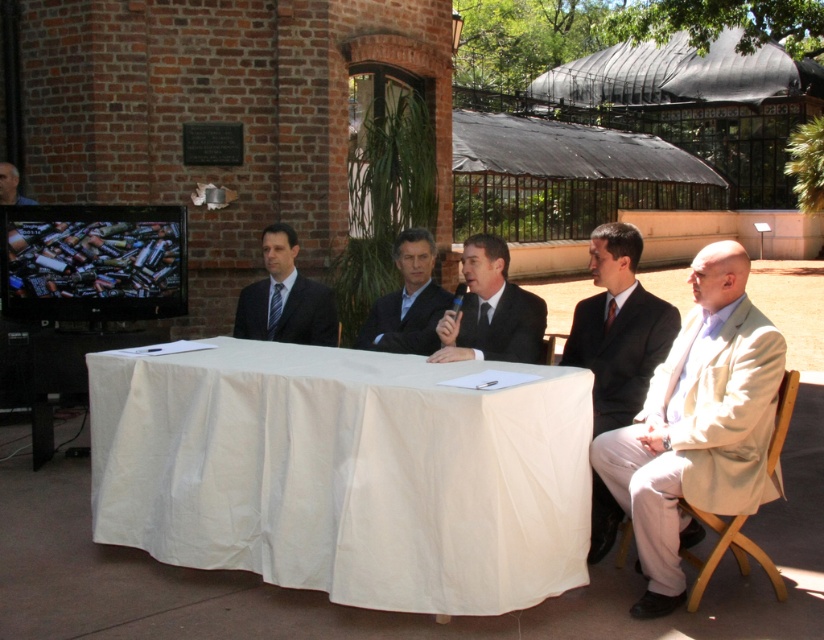
Based on the photo, you are a photographer at the event and need to adjust the camera angle to ensure both the beige fabric suit at right and the matte black suit at center are clearly visible. Considering their heights, which suit might require you to angle the camera higher to capture the person fully?

The beige fabric suit at right is much taller than the matte black suit at center, so angling the camera higher would be necessary to capture the person in the beige fabric suit at right fully.

Based on the photo, you are a photographer trying to capture a closeup of the two points in the image. Which point, point (336, 348) or point (265, 308), is closer to your camera lens?

Point (336, 348) is closer to the camera lens than point (265, 308).

You are standing in front of the table where the men are seated. There are two points marked on the table surface. The first point is at coordinates point (x=640, y=483) and the second point is at point (x=499, y=328). Which point is closer to you?

Point (x=640, y=483) is closer to the viewer than point (x=499, y=328).